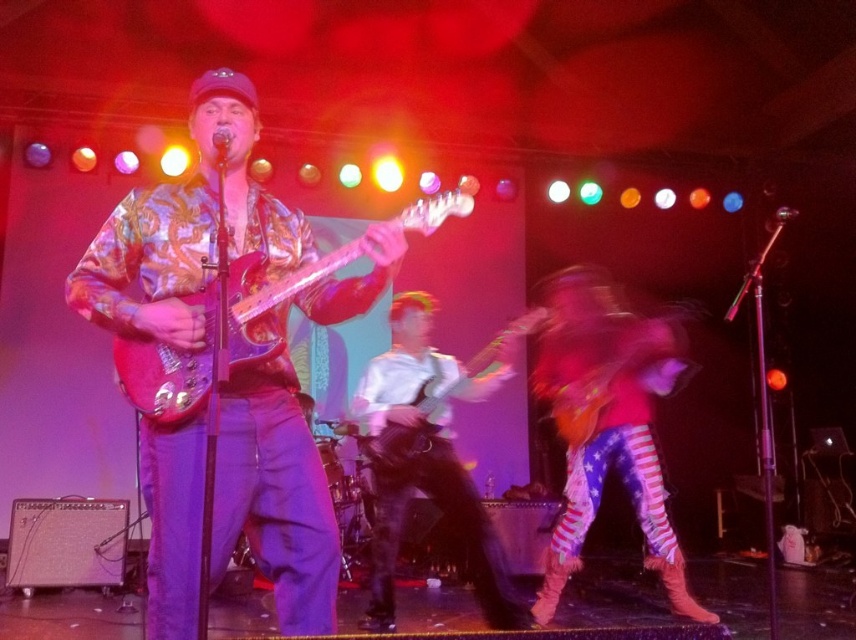
Question: Which point is closer to the camera?

Choices:
 (A) glossy wood guitar at center
 (B) shiny metallic guitar at center
 (C) pink metallic guitar at center

Answer: (C)

Question: Is pink metallic guitar at center to the right of glossy wood guitar at center from the viewer's perspective?

Choices:
 (A) yes
 (B) no

Answer: (B)

Question: Among these points, which one is nearest to the camera?

Choices:
 (A) (147, 352)
 (B) (421, 374)
 (C) (379, 262)

Answer: (A)

Question: Is metallic floral shirt at center further to camera compared to shiny metallic guitar at center?

Choices:
 (A) yes
 (B) no

Answer: (B)

Question: Which object is closer to the camera taking this photo?

Choices:
 (A) pink metallic guitar at center
 (B) white glossy guitar at center
 (C) glossy wood guitar at center
 (D) shiny metallic guitar at center

Answer: (A)

Question: Can you confirm if white glossy guitar at center is smaller than shiny metallic guitar at center?

Choices:
 (A) no
 (B) yes

Answer: (A)